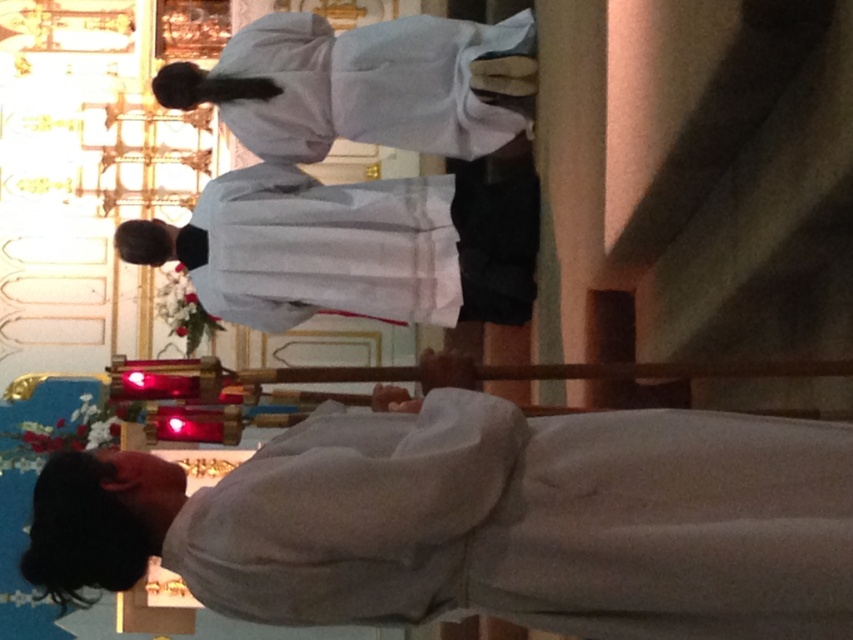
Who is shorter, white soft cloth at lower center or white matte robe at upper center?

white matte robe at upper center

Does white soft cloth at lower center come behind white matte robe at upper center?

No, white soft cloth at lower center is closer to the viewer.

Measure the distance between white soft cloth at lower center and camera.

A distance of 13.68 meters exists between white soft cloth at lower center and camera.

Identify the location of white soft cloth at lower center. This screenshot has height=640, width=853. pos(532,522).

How far apart are white matte robe at center and white matte robe at upper center?

white matte robe at center is 2.59 meters away from white matte robe at upper center.

Can you confirm if white matte robe at center is shorter than white matte robe at upper center?

Yes, white matte robe at center is shorter than white matte robe at upper center.

Measure the distance between point (227, 296) and camera.

Point (227, 296) is 33.65 meters away from camera.

The height and width of the screenshot is (640, 853). In order to click on white matte robe at center in this screenshot , I will do `click(355, 246)`.

Between white soft cloth at lower center and white matte robe at center, which one has more height?

With more height is white soft cloth at lower center.

Does white soft cloth at lower center have a greater width compared to white matte robe at center?

Indeed, white soft cloth at lower center has a greater width compared to white matte robe at center.

Does point (238, 502) come in front of point (405, 292)?

Yes, point (238, 502) is in front of point (405, 292).

Where is `white soft cloth at lower center`? This screenshot has height=640, width=853. white soft cloth at lower center is located at coordinates (532, 522).